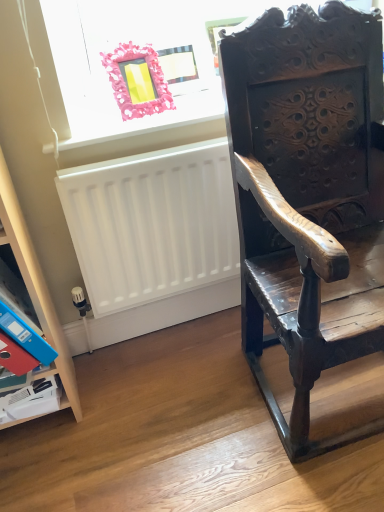
Question: Could you tell me if pink plastic frame at upper left is turned towards dark wood carved chair at right?

Choices:
 (A) yes
 (B) no

Answer: (B)

Question: From a real-world perspective, does pink plastic frame at upper left sit lower than dark wood carved chair at right?

Choices:
 (A) no
 (B) yes

Answer: (A)

Question: Is pink plastic frame at upper left at the left side of dark wood carved chair at right?

Choices:
 (A) no
 (B) yes

Answer: (B)

Question: Is pink plastic frame at upper left looking in the opposite direction of dark wood carved chair at right?

Choices:
 (A) no
 (B) yes

Answer: (A)

Question: Can you confirm if pink plastic frame at upper left is bigger than dark wood carved chair at right?

Choices:
 (A) yes
 (B) no

Answer: (B)

Question: Is pink fabric picture frame at upper left inside or outside of dark wood carved chair at right?

Choices:
 (A) outside
 (B) inside

Answer: (A)

Question: Is pink fabric picture frame at upper left taller or shorter than dark wood carved chair at right?

Choices:
 (A) short
 (B) tall

Answer: (A)

Question: From a real-world perspective, relative to dark wood carved chair at right, is pink fabric picture frame at upper left vertically above or below?

Choices:
 (A) above
 (B) below

Answer: (A)

Question: In the image, is pink fabric picture frame at upper left on the left side or the right side of dark wood carved chair at right?

Choices:
 (A) left
 (B) right

Answer: (A)

Question: Relative to red paper at lower left, is pink fabric picture frame at upper left in front or behind?

Choices:
 (A) behind
 (B) front

Answer: (A)

Question: Looking at the image, does pink fabric picture frame at upper left seem bigger or smaller compared to red paper at lower left?

Choices:
 (A) small
 (B) big

Answer: (B)

Question: From the image's perspective, is pink fabric picture frame at upper left located above or below red paper at lower left?

Choices:
 (A) above
 (B) below

Answer: (A)

Question: Is pink fabric picture frame at upper left situated inside red paper at lower left or outside?

Choices:
 (A) inside
 (B) outside

Answer: (B)

Question: Does point (253, 313) appear closer or farther from the camera than point (127, 99)?

Choices:
 (A) farther
 (B) closer

Answer: (A)

Question: In the image, is dark wood carved chair at right positioned in front of or behind pink fabric picture frame at upper left?

Choices:
 (A) behind
 (B) front

Answer: (B)